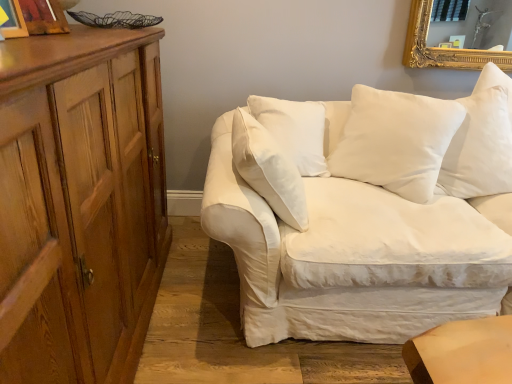
Question: Can you confirm if white cotton couch at center is taller than wooden picture frame at upper left, which is the second picture frame from front to back?

Choices:
 (A) yes
 (B) no

Answer: (A)

Question: Is white cotton couch at center turned away from wooden picture frame at upper left, which is the second picture frame from front to back?

Choices:
 (A) yes
 (B) no

Answer: (B)

Question: Is white cotton couch at center wider than wooden picture frame at upper left, the 1th picture frame when ordered from back to front?

Choices:
 (A) no
 (B) yes

Answer: (B)

Question: From a real-world perspective, is white cotton couch at center under wooden picture frame at upper left, which is the second picture frame from front to back?

Choices:
 (A) no
 (B) yes

Answer: (B)

Question: Is white cotton couch at center to the right of wooden picture frame at upper left, which is the second picture frame from front to back, from the viewer's perspective?

Choices:
 (A) no
 (B) yes

Answer: (B)

Question: From a real-world perspective, is wooden picture frame at upper left, acting as the second picture frame starting from the back, positioned above or below wooden picture frame at upper left, which is the second picture frame from front to back?

Choices:
 (A) above
 (B) below

Answer: (A)

Question: In the image, is wooden picture frame at upper left, acting as the second picture frame starting from the back, positioned in front of or behind wooden picture frame at upper left, which is the second picture frame from front to back?

Choices:
 (A) front
 (B) behind

Answer: (A)

Question: Considering the relative positions of wooden picture frame at upper left, acting as the second picture frame starting from the back, and wooden picture frame at upper left, the 1th picture frame when ordered from back to front, in the image provided, is wooden picture frame at upper left, acting as the second picture frame starting from the back, to the left or to the right of wooden picture frame at upper left, the 1th picture frame when ordered from back to front,?

Choices:
 (A) left
 (B) right

Answer: (B)

Question: In terms of width, does wooden picture frame at upper left, the 1th picture frame in the front-to-back sequence, look wider or thinner when compared to wooden picture frame at upper left, which is the second picture frame from front to back?

Choices:
 (A) wide
 (B) thin

Answer: (B)

Question: From their relative heights in the image, would you say wooden picture frame at upper left, the 1th picture frame when ordered from back to front, is taller or shorter than wooden picture frame at upper left, the 1th picture frame in the front-to-back sequence?

Choices:
 (A) tall
 (B) short

Answer: (B)

Question: Choose the correct answer: Is wooden picture frame at upper left, the 1th picture frame when ordered from back to front, inside wooden picture frame at upper left, acting as the second picture frame starting from the back, or outside it?

Choices:
 (A) outside
 (B) inside

Answer: (A)

Question: Considering the positions of wooden picture frame at upper left, which is the second picture frame from front to back, and wooden picture frame at upper left, the 1th picture frame in the front-to-back sequence, in the image, is wooden picture frame at upper left, which is the second picture frame from front to back, bigger or smaller than wooden picture frame at upper left, the 1th picture frame in the front-to-back sequence,?

Choices:
 (A) big
 (B) small

Answer: (A)

Question: Is wooden picture frame at upper left, the 1th picture frame when ordered from back to front, wider or thinner than wooden picture frame at upper left, acting as the second picture frame starting from the back?

Choices:
 (A) thin
 (B) wide

Answer: (B)

Question: Looking at the image, does wooden picture frame at upper left, the 1th picture frame in the front-to-back sequence, seem bigger or smaller compared to white soft pillow at upper right, the 2th pillow in the left-to-right sequence?

Choices:
 (A) big
 (B) small

Answer: (B)

Question: Considering their positions, is wooden picture frame at upper left, acting as the second picture frame starting from the back, located in front of or behind white soft pillow at upper right, the 2th pillow in the left-to-right sequence?

Choices:
 (A) behind
 (B) front

Answer: (B)